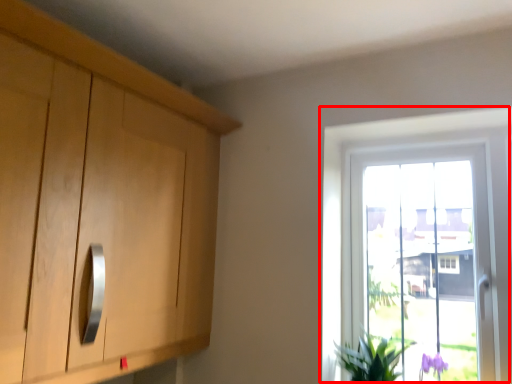
Question: In this image, where is window (annotated by the red box) located relative to houseplant?

Choices:
 (A) left
 (B) right

Answer: (B)